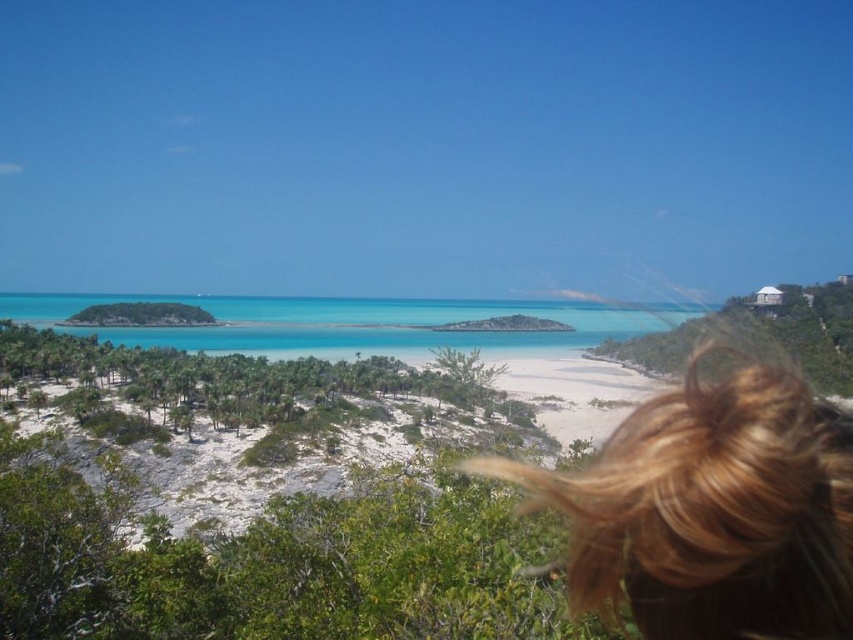
How much distance is there between blonde hair at lower right and turquoise crystal clear water at center?

blonde hair at lower right is 1009.01 feet away from turquoise crystal clear water at center.

The width and height of the screenshot is (853, 640). What do you see at coordinates (711, 509) in the screenshot? I see `blonde hair at lower right` at bounding box center [711, 509].

What do you see at coordinates (711, 509) in the screenshot? The width and height of the screenshot is (853, 640). I see `blonde hair at lower right` at bounding box center [711, 509].

This screenshot has height=640, width=853. What are the coordinates of `blonde hair at lower right` in the screenshot? It's located at (711, 509).